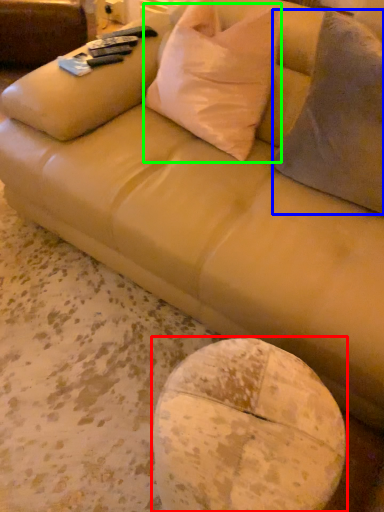
Question: Which is farther away from round table (highlighted by a red box)? throw pillow (highlighted by a blue box) or throw pillow (highlighted by a green box)?

Choices:
 (A) throw pillow
 (B) throw pillow

Answer: (B)